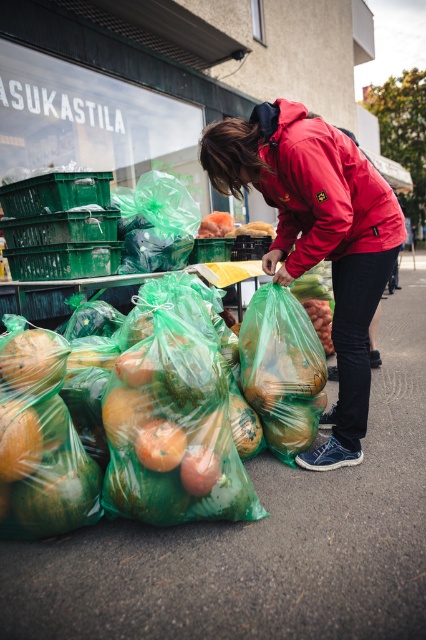
You are standing at the point closest to the store entrance. There are two points marked in the scene, one at coordinate point (351, 140) and another at point (149, 435). Which point is farther away from you?

Point (351, 140) is behind point (149, 435), so the point farther away from you is point (351, 140).

You are standing in front of the store Sukastila and want to take a photo of the green plastic bags filled with fruits and vegetables. The bags are located at point (256,166). If your camera has a focal length of 50mm and you want to capture the entire scene without moving closer, what is the minimum distance in feet you should maintain from the bags to ensure they are in focus?

The point (256,166) is 7.80 feet from the camera. To ensure the green plastic bags at point (256,166) are in focus, you should maintain a distance of at least 7.80 feet from the bags.

You are standing in front of the store named Sukastila and see the red matte jacket at center. If you walk straight ahead, will you step over the jacket?

The red matte jacket at center is located at point (322,189), which is likely in your path if you walk straight ahead. Therefore, you will step over the jacket.